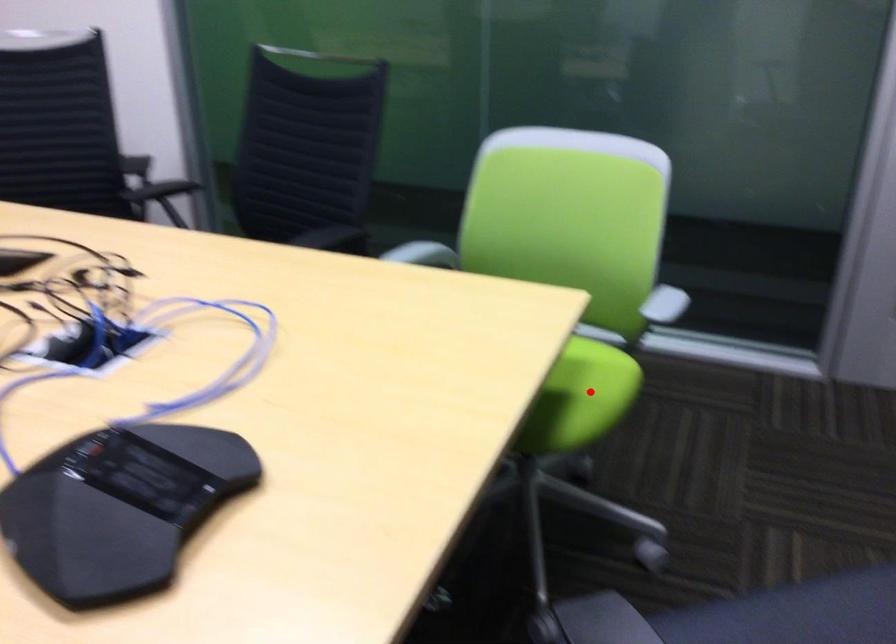
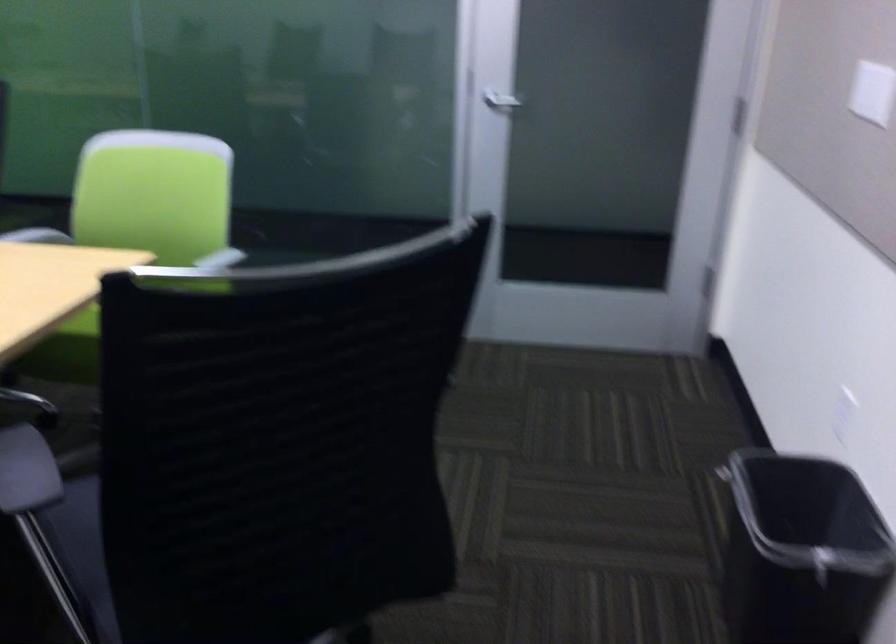
Question: I am providing you with two images of the same scene from different viewpoints. A red point is marked on the first image. Can you still see the location of the red point in image 2?

Choices:
 (A) Yes
 (B) No

Answer: (B)